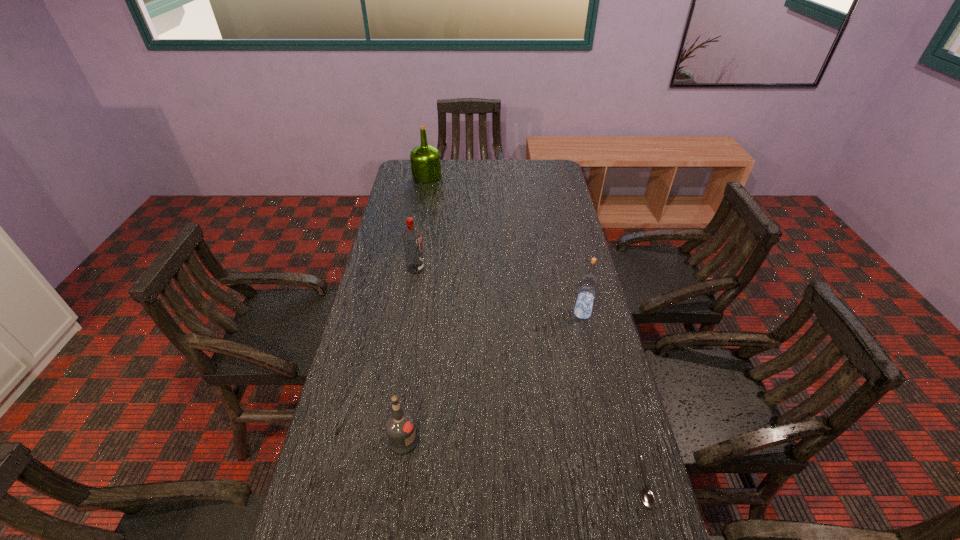
This screenshot has height=540, width=960. In order to click on vacant space that's between the farthest vodka and the fourth farthest object in this screenshot , I will do `click(410, 355)`.

You are a GUI agent. You are given a task and a screenshot of the screen. Output one action in this format:
    pyautogui.click(x=<x>, y=<y>)
    Task: Click on the free area in between the soupspoon and the nearest vodka
    
    Given the screenshot: What is the action you would take?
    pyautogui.click(x=523, y=462)

In order to click on vacant area that lies between the shortest object and the second nearest object in this screenshot , I will do `click(523, 462)`.

Where is `blank region between the farthest object and the rightmost object`? blank region between the farthest object and the rightmost object is located at coordinates (535, 329).

Identify the location of object that stands as the closest to the rightmost vodka. The height and width of the screenshot is (540, 960). (647, 498).

Identify which object is the third closest to the nearest object. Please provide its 2D coordinates. Your answer should be formatted as a tuple, i.e. [(x, y)], where the tuple contains the x and y coordinates of a point satisfying the conditions above.

[(411, 237)]

Find the location of a particular element. This screenshot has height=540, width=960. vodka that is the second nearest to the farthest object is located at coordinates (588, 284).

The height and width of the screenshot is (540, 960). Identify the location of the third closest vodka relative to the farthest object. (400, 427).

The width and height of the screenshot is (960, 540). I want to click on vacant space that satisfies the following two spatial constraints: 1. on the front label of the second farthest vodka; 2. on the left side of the second farthest object, so click(408, 313).

Identify the location of free space that satisfies the following two spatial constraints: 1. on the front label of the rightmost object; 2. on the right side of the farthest vodka. (380, 483).